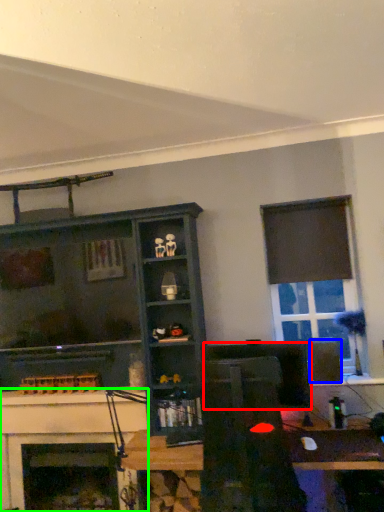
Question: Estimate the real-world distances between objects in this image. Which object is farther from computer monitor (highlighted by a red box), speaker (highlighted by a blue box) or fireplace (highlighted by a green box)?

Choices:
 (A) speaker
 (B) fireplace

Answer: (B)